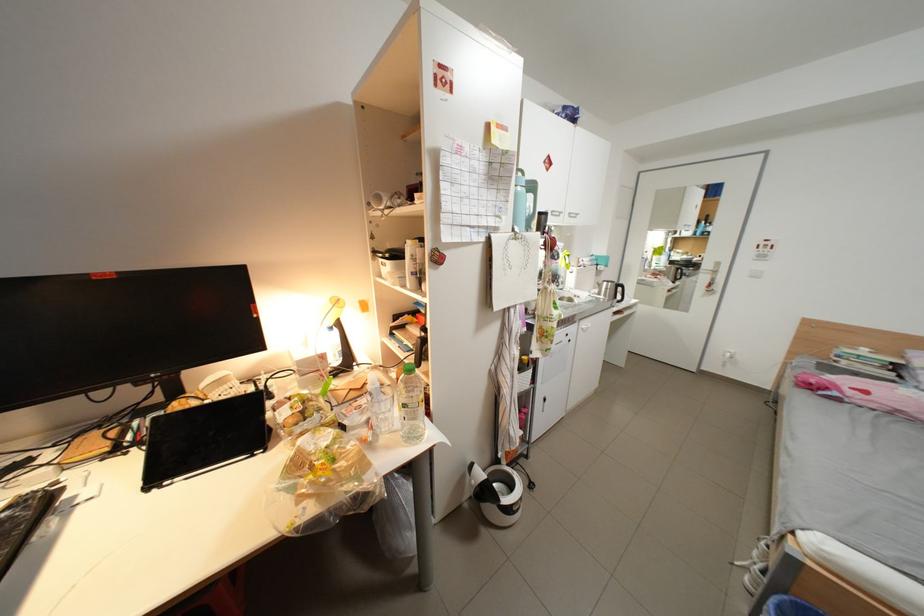
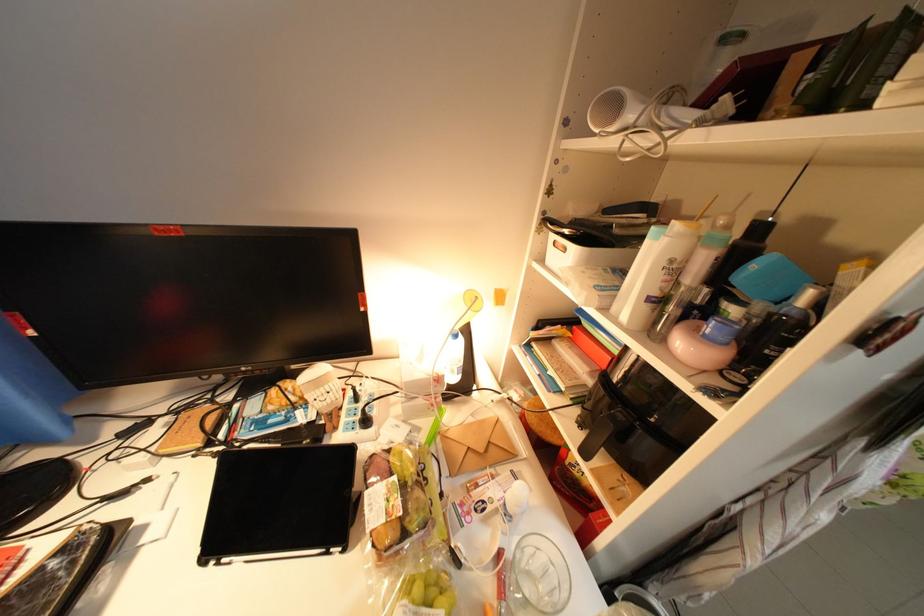
In the second image, find the point that corresponds to [391,200] in the first image.

(625, 108)